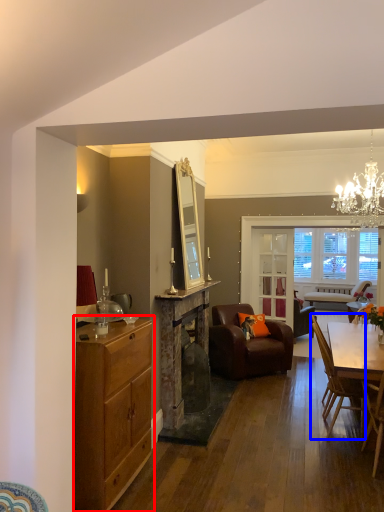
Question: Which of the following is the closest to the observer, cabinetry (highlighted by a red box) or chair (highlighted by a blue box)?

Choices:
 (A) cabinetry
 (B) chair

Answer: (A)